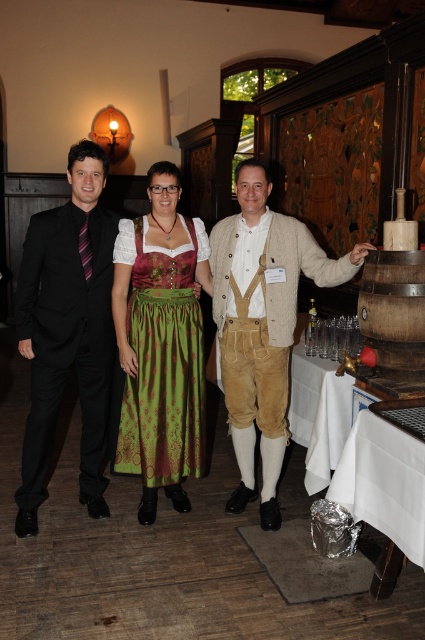
Measure the distance between green satin dirndl at center and camera.

A distance of 2.74 meters exists between green satin dirndl at center and camera.

I want to click on green satin dirndl at center, so click(x=164, y=362).

This screenshot has width=425, height=640. What do you see at coordinates (164, 362) in the screenshot?
I see `green satin dirndl at center` at bounding box center [164, 362].

Locate an element on the screen. The image size is (425, 640). green satin dirndl at center is located at coordinates (164, 362).

Does green satin dirndl at center come behind white cloth at right?

That is True.

This screenshot has width=425, height=640. What do you see at coordinates (164, 362) in the screenshot? I see `green satin dirndl at center` at bounding box center [164, 362].

What do you see at coordinates (164, 362) in the screenshot? I see `green satin dirndl at center` at bounding box center [164, 362].

I want to click on green satin dirndl at center, so click(x=164, y=362).

Can you confirm if black satin suit at left is positioned to the right of green textured dirndl at center?

No, black satin suit at left is not to the right of green textured dirndl at center.

Is black satin suit at left closer to camera compared to green textured dirndl at center?

Yes, it is.

Does point (82, 172) come behind point (164, 234)?

No, (82, 172) is in front of (164, 234).

At what (x,y) coordinates should I click in order to perform the action: click on black satin suit at left. Please return your answer as a coordinate pair (x, y). Looking at the image, I should click on (68, 330).